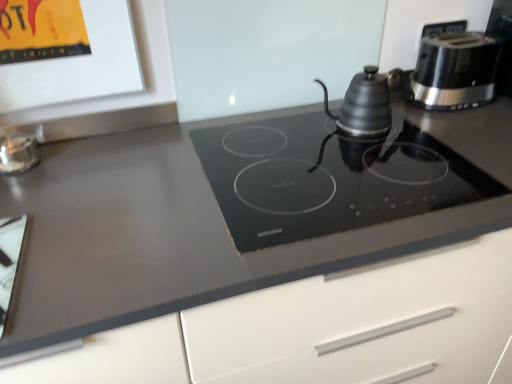
At what (x,y) coordinates should I click in order to perform the action: click on vacant space to the right of clear glass jar at left, which is the second appliance in front-to-back order. Please return your answer as a coordinate pair (x, y). Looking at the image, I should click on point(95,157).